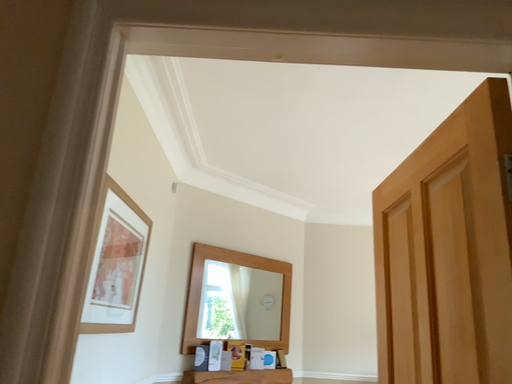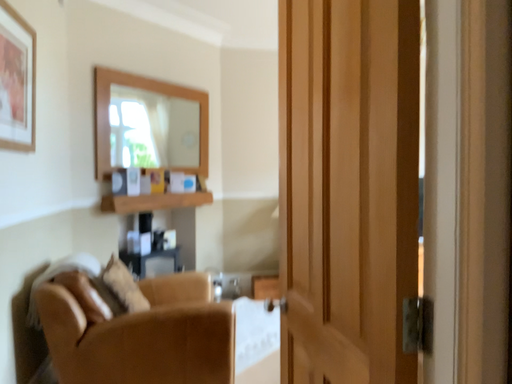
Question: How did the camera likely rotate when shooting the video?

Choices:
 (A) rotated upward
 (B) rotated downward

Answer: (B)